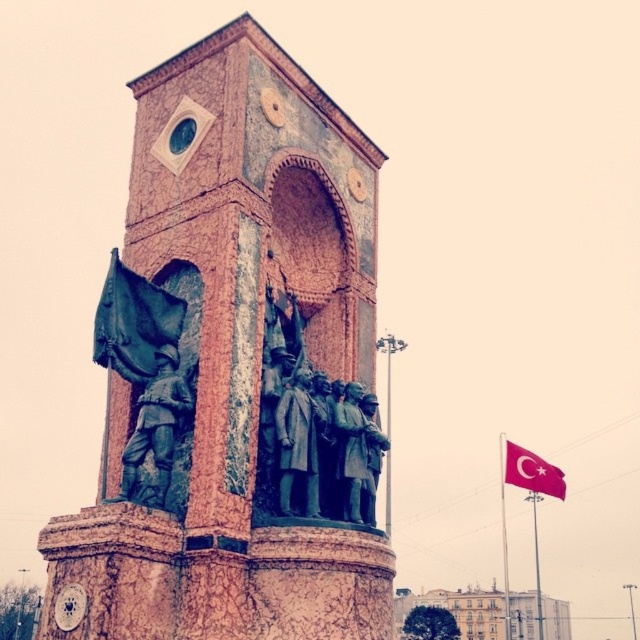
You are a tourist standing in front of the monument. You notice the green patina statue at center and the red fabric flag at right. Which object is closer to you?

The green patina statue at center is closer to you because it is in front of the red fabric flag at right.

You are a tourist standing in front of the rustic stone tower at center. You notice a red fabric flag at right. Which object is closer to you, the tourist?

The rustic stone tower at center is closer to you because it is in front of the red fabric flag at right.

You are an art conservator assessing the monument. You notice the green patina statue at center and the red fabric flag at right. Which object has a smaller width when viewed from the front?

The green patina statue at center is thinner than the red fabric flag at right, so the green patina statue at center has a smaller width when viewed from the front.